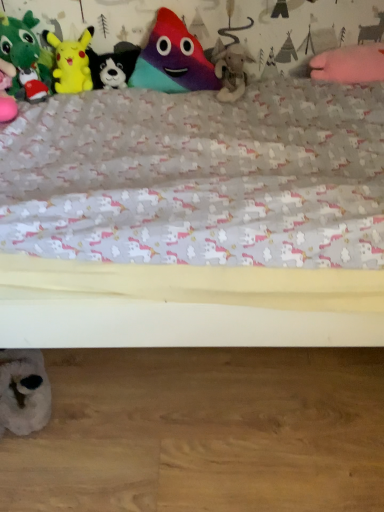
Question: Should I look upward or downward to see yellow plush at upper left, acting as the second toy starting from the top?

Choices:
 (A) up
 (B) down

Answer: (A)

Question: Is white plush toy at lower left, marked as the 6th toy in a top-to-bottom arrangement, facing towards yellow plush at upper left, the 5th toy positioned from the bottom?

Choices:
 (A) no
 (B) yes

Answer: (A)

Question: Is white plush toy at lower left, which appears as the 1th toy when ordered from the bottom, bigger than yellow plush at upper left, the 5th toy positioned from the bottom?

Choices:
 (A) yes
 (B) no

Answer: (B)

Question: Are white plush toy at lower left, marked as the 6th toy in a top-to-bottom arrangement, and yellow plush at upper left, the 5th toy positioned from the bottom, beside each other?

Choices:
 (A) yes
 (B) no

Answer: (B)

Question: Is white plush toy at lower left, marked as the 6th toy in a top-to-bottom arrangement, shorter than yellow plush at upper left, the 5th toy positioned from the bottom?

Choices:
 (A) no
 (B) yes

Answer: (B)

Question: Is white plush toy at lower left, which appears as the 1th toy when ordered from the bottom, far from yellow plush at upper left, the 5th toy positioned from the bottom?

Choices:
 (A) no
 (B) yes

Answer: (A)

Question: Considering the relative positions of white plush toy at lower left, which appears as the 1th toy when ordered from the bottom, and yellow plush at upper left, the 5th toy positioned from the bottom, in the image provided, is white plush toy at lower left, which appears as the 1th toy when ordered from the bottom, behind yellow plush at upper left, the 5th toy positioned from the bottom,?

Choices:
 (A) yes
 (B) no

Answer: (B)

Question: From the image's perspective, is yellow plush at upper left, the 5th toy positioned from the bottom, on black plush dog at upper center, positioned as the fourth toy in top-to-bottom order?

Choices:
 (A) no
 (B) yes

Answer: (B)

Question: From the image's perspective, does yellow plush at upper left, the 5th toy positioned from the bottom, appear lower than black plush dog at upper center, positioned as the fourth toy in top-to-bottom order?

Choices:
 (A) no
 (B) yes

Answer: (A)

Question: Can you confirm if yellow plush at upper left, the 5th toy positioned from the bottom, is wider than black plush dog at upper center, positioned as the fourth toy in top-to-bottom order?

Choices:
 (A) no
 (B) yes

Answer: (B)

Question: Does yellow plush at upper left, acting as the second toy starting from the top, have a lesser height compared to black plush dog at upper center, the third toy from the bottom?

Choices:
 (A) yes
 (B) no

Answer: (B)

Question: From a real-world perspective, is yellow plush at upper left, acting as the second toy starting from the top, located higher than black plush dog at upper center, the third toy from the bottom?

Choices:
 (A) no
 (B) yes

Answer: (B)

Question: Considering the relative positions of yellow plush at upper left, acting as the second toy starting from the top, and black plush dog at upper center, positioned as the fourth toy in top-to-bottom order, in the image provided, is yellow plush at upper left, acting as the second toy starting from the top, behind black plush dog at upper center, positioned as the fourth toy in top-to-bottom order,?

Choices:
 (A) yes
 (B) no

Answer: (B)

Question: From the image's perspective, is green plush toy at left, arranged as the fourth toy when ordered from the bottom, located above multicolored plush toy at center, which is the 6th toy from bottom to top?

Choices:
 (A) no
 (B) yes

Answer: (A)